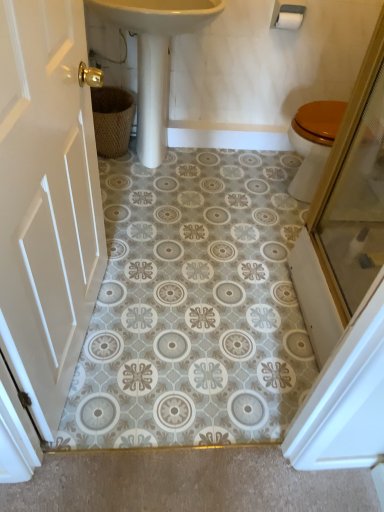
This screenshot has width=384, height=512. Describe the element at coordinates (47, 199) in the screenshot. I see `white wood door at left` at that location.

Measure the distance between woven brown basket at left and camera.

The distance of woven brown basket at left from camera is 2.31 meters.

Describe the element at coordinates (289, 17) in the screenshot. I see `white matte toilet paper at upper right` at that location.

Locate an element on the screen. This screenshot has width=384, height=512. white wood door at left is located at coordinates (47, 199).

The width and height of the screenshot is (384, 512). Identify the location of basket on the left side of white matte toilet paper at upper right. (112, 120).

Which object is positioned more to the right, white matte toilet paper at upper right or woven brown basket at left?

From the viewer's perspective, white matte toilet paper at upper right appears more on the right side.

Measure the distance from white matte toilet paper at upper right to woven brown basket at left.

white matte toilet paper at upper right and woven brown basket at left are 38.29 inches apart.

Can you confirm if woven brown basket at left is taller than white wood door at left?

Incorrect, the height of woven brown basket at left is not larger of that of white wood door at left.

Based on their sizes in the image, would you say woven brown basket at left is bigger or smaller than white wood door at left?

Clearly, woven brown basket at left is smaller in size than white wood door at left.

From the image's perspective, which is below, woven brown basket at left or white wood door at left?

white wood door at left appears lower in the image.

From a real-world perspective, is woven brown basket at left above or below white wood door at left?

Clearly, from a real-world perspective, woven brown basket at left is below white wood door at left.

Is white glossy sink at center taller than woven brown basket at left?

Yes, white glossy sink at center is taller than woven brown basket at left.

How distant is white glossy sink at center from woven brown basket at left?

11.05 inches.

In the scene shown: From the image's perspective, between white glossy sink at center and woven brown basket at left, who is located below?

From the image's view, woven brown basket at left is below.

Are white glossy sink at center and woven brown basket at left far apart?

That's not correct — white glossy sink at center is a little close to woven brown basket at left.

Is white wood door at left beside white matte toilet paper at upper right?

No, white wood door at left is not in contact with white matte toilet paper at upper right.

Consider the image. From the image's perspective, which one is positioned lower, white wood door at left or white matte toilet paper at upper right?

white wood door at left, from the image's perspective.

Could you tell me if white wood door at left is facing white matte toilet paper at upper right?

No, white wood door at left is not aimed at white matte toilet paper at upper right.

From the image's perspective, between white matte toilet paper at upper right and white wood door at left, who is located below?

white wood door at left.

Is white matte toilet paper at upper right further to the viewer compared to white wood door at left?

Yes, it is.

Is white matte toilet paper at upper right oriented towards white wood door at left?

No.

Does point (283, 18) appear closer or farther from the camera than point (43, 350)?

Point (283, 18).

Is white wood door at left taller or shorter than woven brown basket at left?

white wood door at left is taller than woven brown basket at left.

Which is closer, (x=20, y=229) or (x=117, y=87)?

Point (x=20, y=229).

Considering the relative positions of white wood door at left and woven brown basket at left in the image provided, is white wood door at left to the right of woven brown basket at left from the viewer's perspective?

Indeed, white wood door at left is positioned on the right side of woven brown basket at left.

Is woven brown basket at left inside white wood door at left?

No, woven brown basket at left is not surrounded by white wood door at left.

Is white wood door at left facing away from white glossy sink at center?

No, white wood door at left's orientation is not away from white glossy sink at center.

Does white wood door at left appear on the right side of white glossy sink at center?

No.

From the image's perspective, would you say white wood door at left is shown under white glossy sink at center?

Yes, from the image's perspective, white wood door at left is below white glossy sink at center.

I want to click on basket behind the white matte toilet paper at upper right, so click(x=112, y=120).

Locate an element on the screen. Image resolution: width=384 pixels, height=512 pixels. door on the right of woven brown basket at left is located at coordinates (47, 199).

Which object lies nearer to the anchor point white wood door at left, white matte toilet paper at upper right or woven brown basket at left?

woven brown basket at left is positioned closer to the anchor white wood door at left.

Considering their positions, is woven brown basket at left positioned closer to white glossy sink at center than white wood door at left?

Based on the image, woven brown basket at left appears to be nearer to white glossy sink at center.

Which object lies further to the anchor point woven brown basket at left, white glossy sink at center or white wood door at left?

The object further to woven brown basket at left is white wood door at left.

From the picture: When comparing their distances from woven brown basket at left, does white glossy sink at center or white matte toilet paper at upper right seem further?

white matte toilet paper at upper right lies further to woven brown basket at left than the other object.

From the image, which object appears to be farther from woven brown basket at left, white matte toilet paper at upper right or white wood door at left?

white wood door at left lies further to woven brown basket at left than the other object.

When comparing their distances from white glossy sink at center, does woven brown basket at left or white matte toilet paper at upper right seem closer?

Based on the image, woven brown basket at left appears to be nearer to white glossy sink at center.

Estimate the real-world distances between objects in this image. Which object is closer to white matte toilet paper at upper right, white glossy sink at center or white wood door at left?

white glossy sink at center is positioned closer to the anchor white matte toilet paper at upper right.

Based on their spatial positions, is white glossy sink at center or woven brown basket at left further from white wood door at left?

Based on the image, woven brown basket at left appears to be further to white wood door at left.

In order to click on toilet paper located between white wood door at left and woven brown basket at left in the depth direction in this screenshot , I will do `click(289, 17)`.

This screenshot has height=512, width=384. Find the location of `sink located between woven brown basket at left and white matte toilet paper at upper right in the left-right direction`. sink located between woven brown basket at left and white matte toilet paper at upper right in the left-right direction is located at coordinates (155, 57).

Find the location of a particular element. The image size is (384, 512). sink positioned between white wood door at left and woven brown basket at left from near to far is located at coordinates (155, 57).

At what (x,y) coordinates should I click in order to perform the action: click on sink positioned between white wood door at left and white matte toilet paper at upper right from near to far. Please return your answer as a coordinate pair (x, y). The width and height of the screenshot is (384, 512). Looking at the image, I should click on (155, 57).